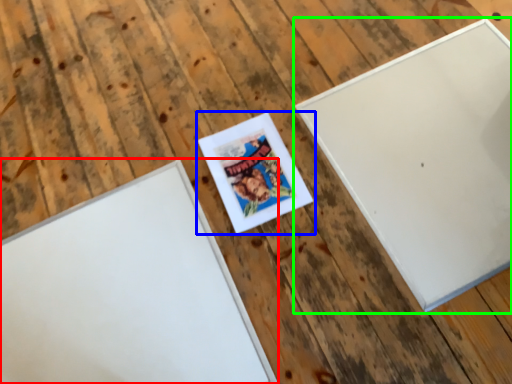
Question: Which is farther away from picture frame (highlighted by a red box)? picture frame (highlighted by a blue box) or picture frame (highlighted by a green box)?

Choices:
 (A) picture frame
 (B) picture frame

Answer: (B)